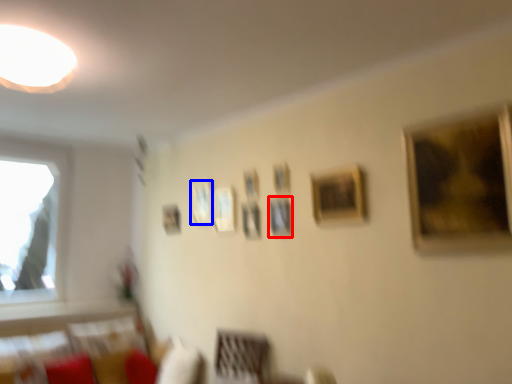
Question: Among these objects, which one is nearest to the camera, picture frame (highlighted by a red box) or picture frame (highlighted by a blue box)?

Choices:
 (A) picture frame
 (B) picture frame

Answer: (A)